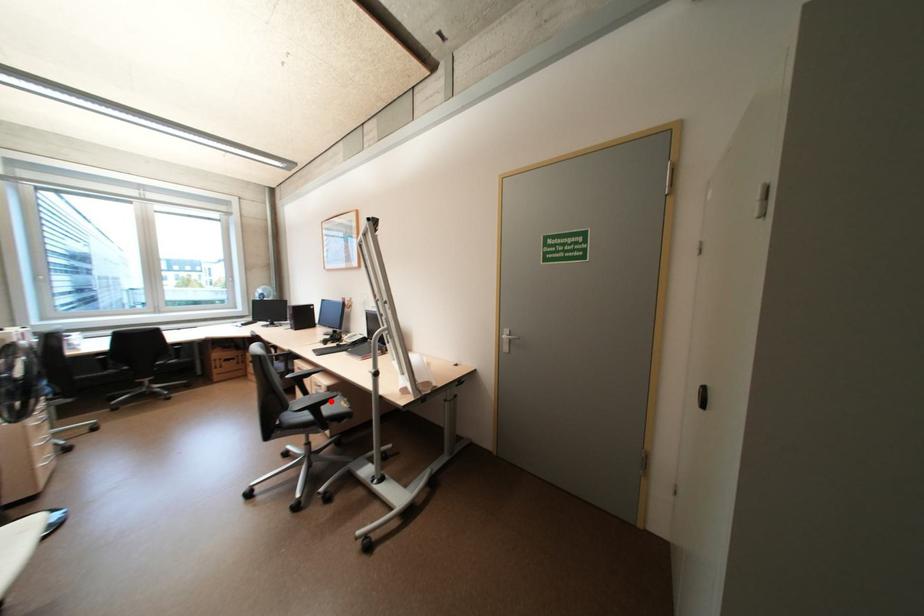
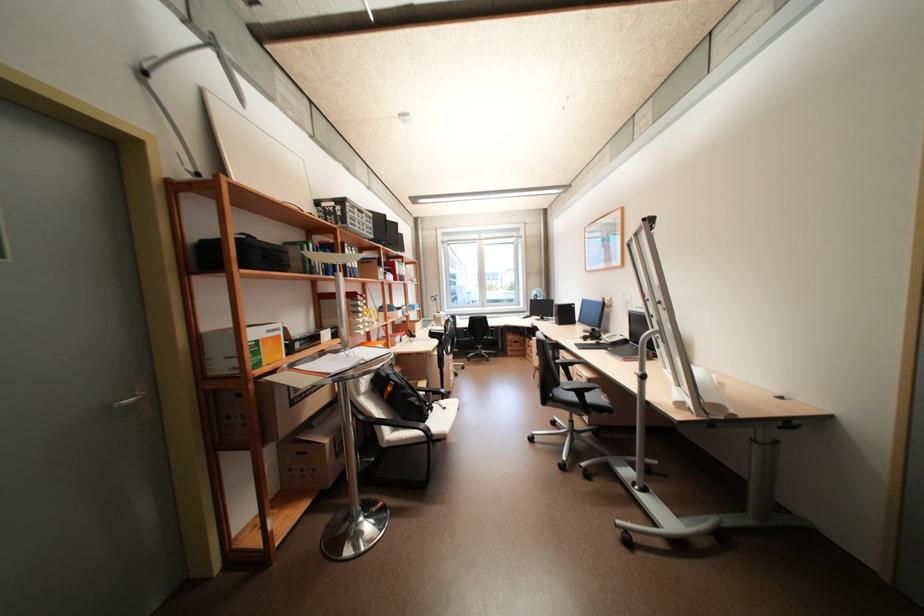
Where in the second image is the point corresponding to the highlighted location from the first image?

(593, 390)